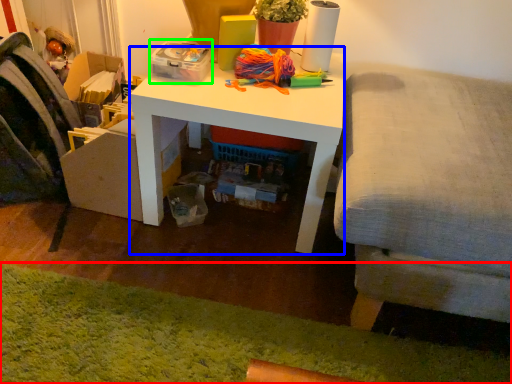
Question: Considering the real-world distances, which object is farthest from mat (highlighted by a red box)? desk (highlighted by a blue box) or storage box (highlighted by a green box)?

Choices:
 (A) desk
 (B) storage box

Answer: (B)